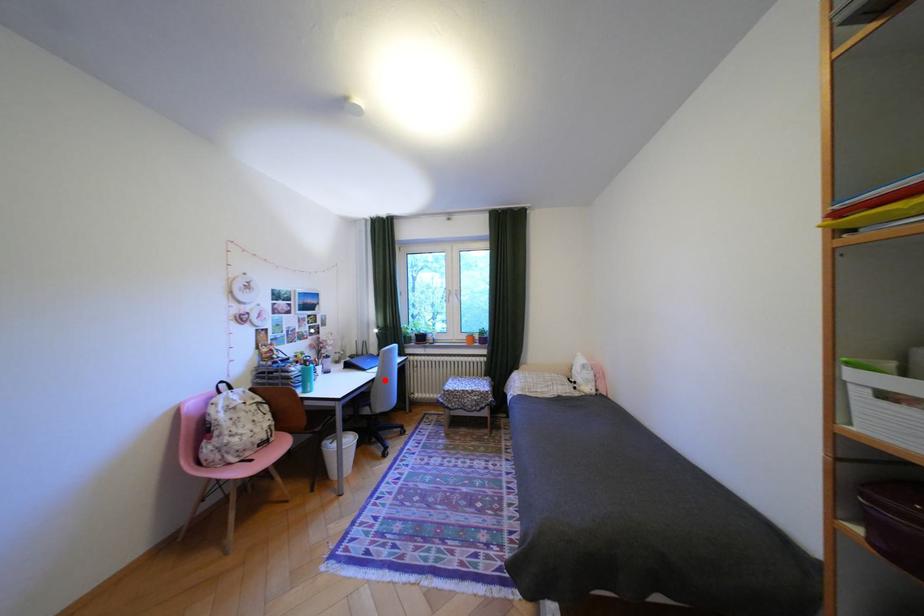
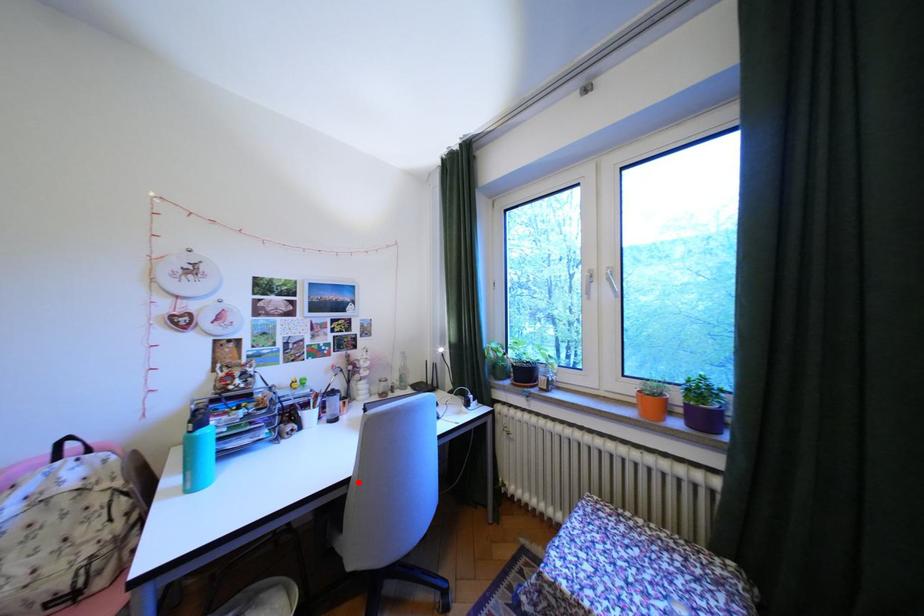
Looking at this image, I am providing you with two images of the same scene from different viewpoints. A red point is marked on the first image and another point is marked on the second image. Are the points marked in image1 and image2 representing the same 3D position?

Yes